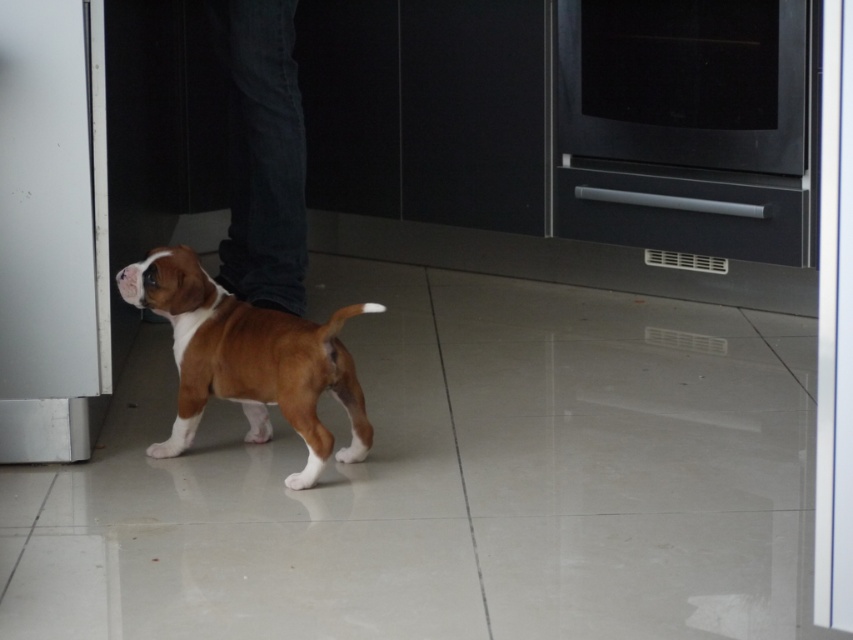
Question: Which point is farther to the camera?

Choices:
 (A) (279, 330)
 (B) (247, 45)
 (C) (581, 72)

Answer: (C)

Question: Which is farther from the dark blue jeans at center?

Choices:
 (A) black matte oven at upper right
 (B) brown matte dog at center

Answer: (A)

Question: Which point is closer to the camera?

Choices:
 (A) (223, 253)
 (B) (210, 368)
 (C) (630, 26)

Answer: (B)

Question: Is black matte oven at upper right positioned at the back of dark blue jeans at center?

Choices:
 (A) no
 (B) yes

Answer: (B)

Question: Does black matte oven at upper right have a lesser width compared to dark blue jeans at center?

Choices:
 (A) no
 (B) yes

Answer: (A)

Question: Is brown matte dog at center positioned before dark blue jeans at center?

Choices:
 (A) no
 (B) yes

Answer: (B)